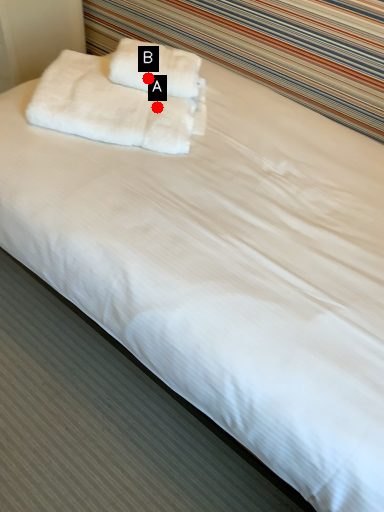
Question: Two points are circled on the image, labeled by A and B beside each circle. Which of the following is the farthest from the observer?

Choices:
 (A) A is further
 (B) B is further

Answer: (B)